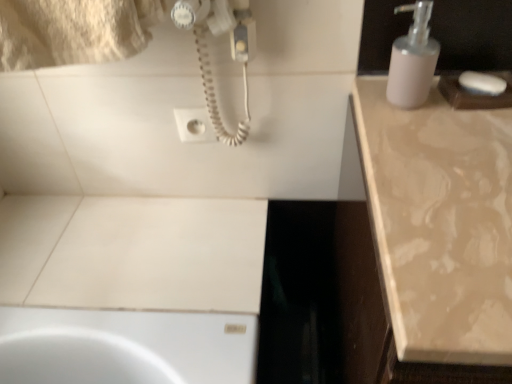
Question: Is white matte soap dispenser at upper right taller or shorter than white matte soap at upper right?

Choices:
 (A) tall
 (B) short

Answer: (A)

Question: Is white matte soap dispenser at upper right spatially inside white matte soap at upper right, or outside of it?

Choices:
 (A) outside
 (B) inside

Answer: (A)

Question: Based on their relative distances, which object is farther from the white matte soap dispenser at upper right?

Choices:
 (A) white plastic socket at upper center
 (B) beige marble countertop at right
 (C) white matte soap at upper right

Answer: (A)

Question: Which object is positioned closest to the white matte soap dispenser at upper right?

Choices:
 (A) beige marble countertop at right
 (B) white plastic socket at upper center
 (C) white matte soap at upper right

Answer: (C)